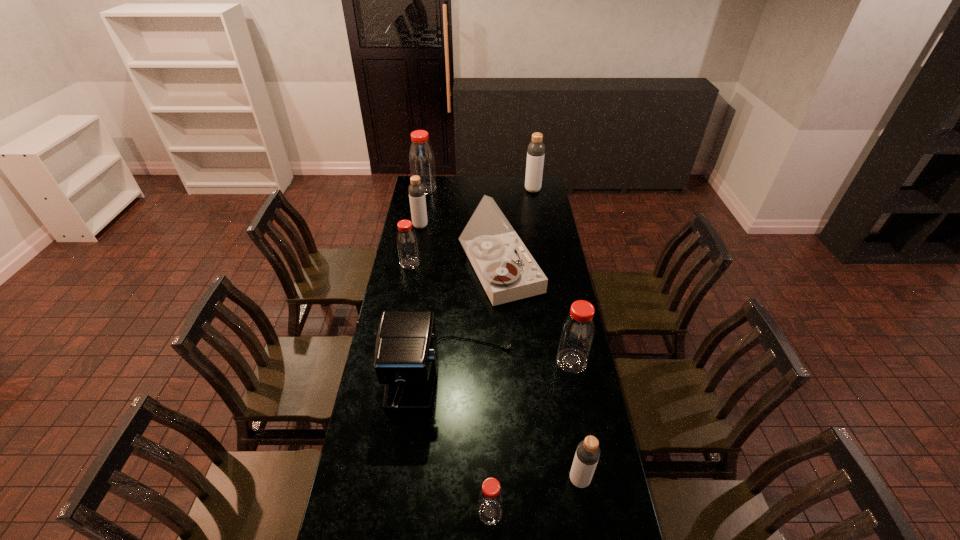
I want to click on vacant area located on the back of the fourth nearest bottle, so click(x=418, y=219).

Find the location of a particular element. The height and width of the screenshot is (540, 960). free region located on the left of the second nearest object is located at coordinates pyautogui.click(x=493, y=480).

What are the coordinates of `free spot located 0.150m on the right of the fourth bottle from right to left` in the screenshot? It's located at (553, 512).

I want to click on coffee maker present at the left edge, so click(406, 353).

Locate an element on the screen. record player present at the right edge is located at coordinates (507, 271).

Identify the location of object that is positioned at the far left corner. This screenshot has width=960, height=540. (421, 157).

Where is `object located at the far right corner`? object located at the far right corner is located at coordinates (536, 149).

Image resolution: width=960 pixels, height=540 pixels. What are the coordinates of `vacant region at the left edge of the desktop` in the screenshot? It's located at (395, 307).

This screenshot has height=540, width=960. Find the location of `free space at the right edge of the desktop`. free space at the right edge of the desktop is located at coordinates (574, 522).

The width and height of the screenshot is (960, 540). Identify the location of empty space that is in between the eighth farthest object and the biggest red bottle. (502, 334).